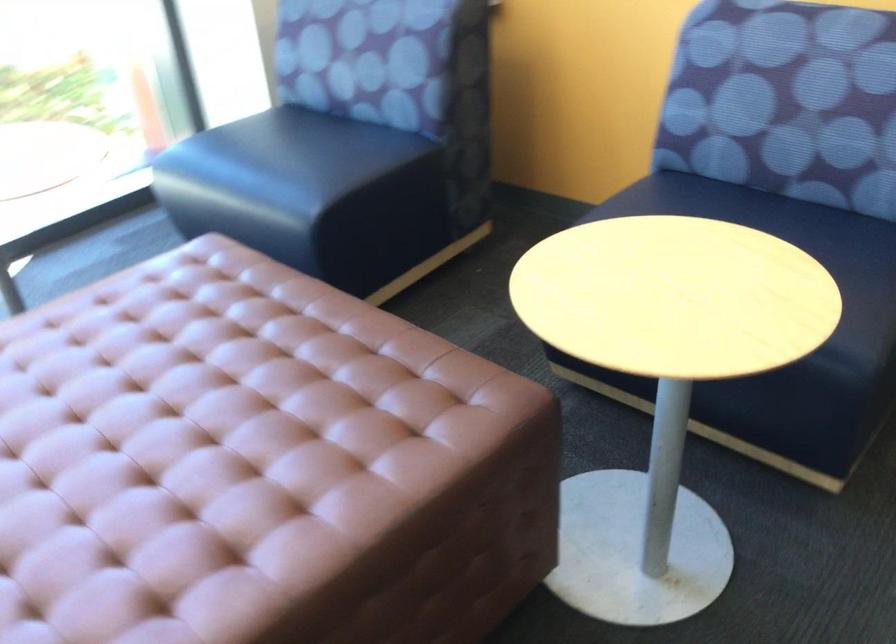
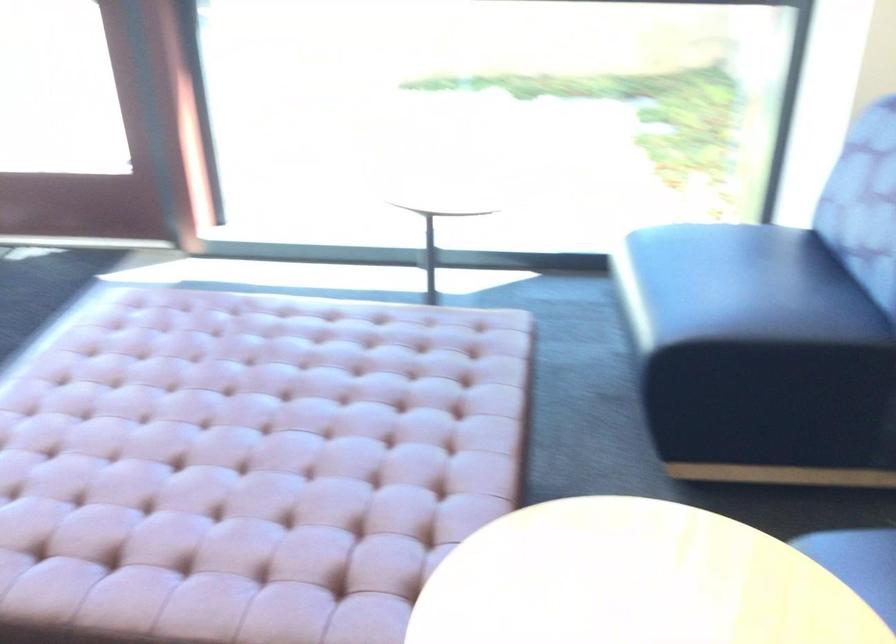
Where in the second image is the point corresponding to pixel 186 371 from the first image?

(306, 406)